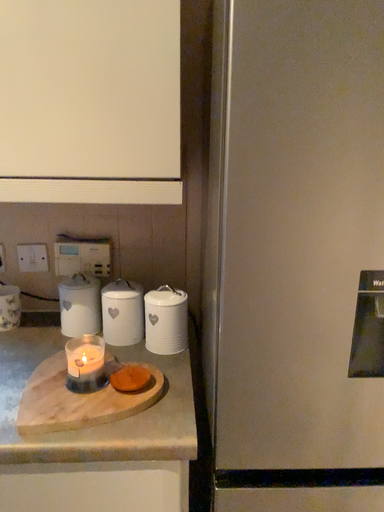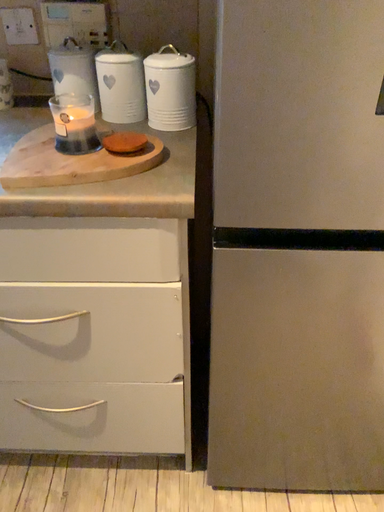
Question: How did the camera likely rotate when shooting the video?

Choices:
 (A) rotated downward
 (B) rotated upward

Answer: (A)